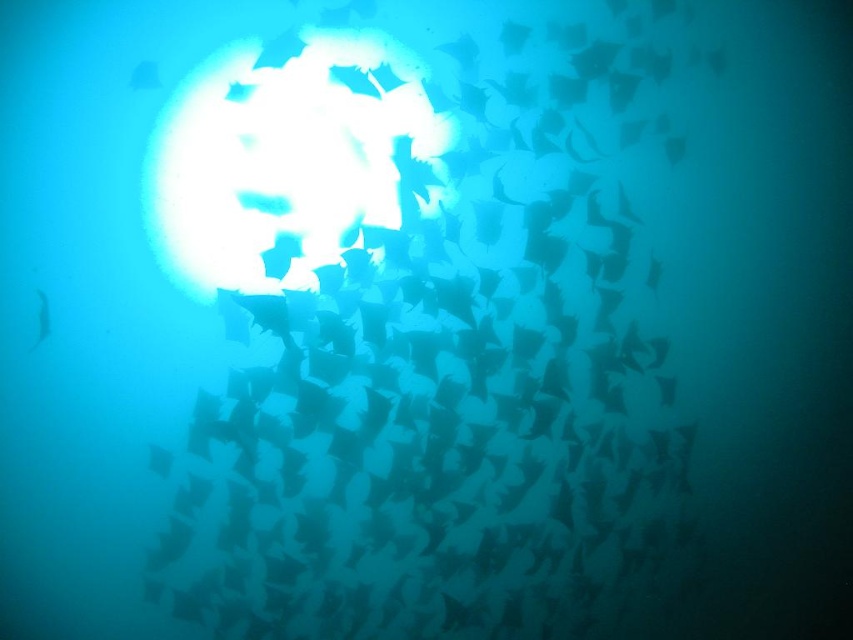
Consider the image. Does translucent white fish at center appear under translucent blue fish at left?

Yes.

Consider the image. Who is more distant from viewer, (637, 388) or (48, 314)?

The point (637, 388) is behind.

Locate an element on the screen. Image resolution: width=853 pixels, height=640 pixels. translucent white fish at center is located at coordinates (444, 419).